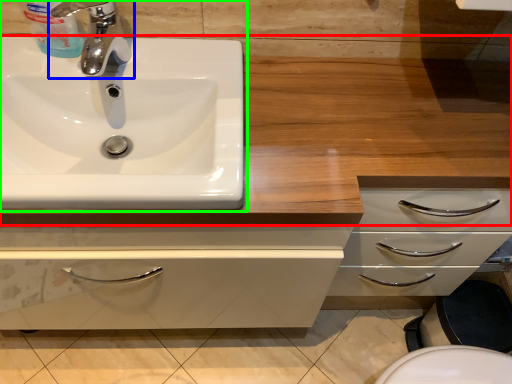
Question: Which object is positioned farthest from counter top (highlighted by a red box)? Select from tap (highlighted by a blue box) and sink (highlighted by a green box).

Choices:
 (A) tap
 (B) sink

Answer: (A)